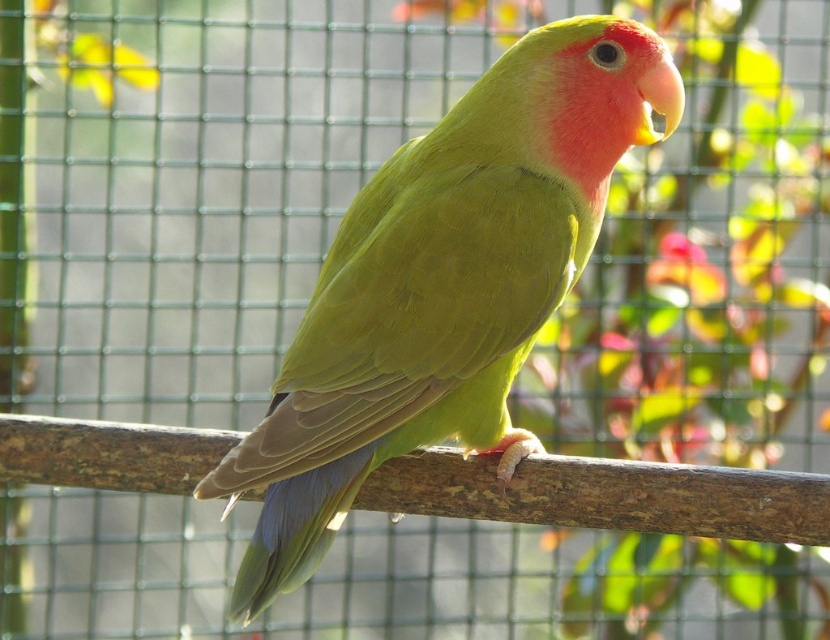
Is green matte parrot at center closer to camera compared to brown wood at center?

Yes.

Between green matte parrot at center and brown wood at center, which one appears on the right side from the viewer's perspective?

green matte parrot at center

Is point (344, 241) in front of point (56, 467)?

Yes, point (344, 241) is in front of point (56, 467).

Image resolution: width=830 pixels, height=640 pixels. I want to click on green matte parrot at center, so click(443, 285).